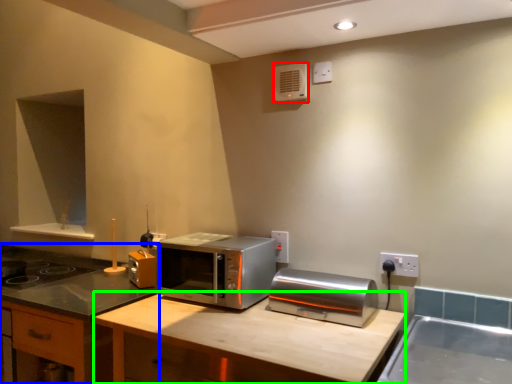
Question: Which is farther away from air conditioner (highlighted by a red box)? cabinetry (highlighted by a blue box) or counter top (highlighted by a green box)?

Choices:
 (A) cabinetry
 (B) counter top

Answer: (A)